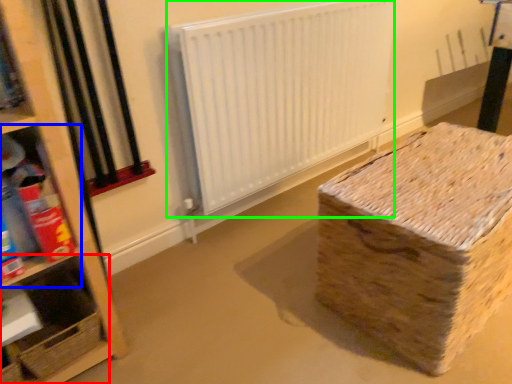
Question: Which object is the farthest from shelf (highlighted by a red box)? Choose among these: shelf (highlighted by a blue box) or radiator (highlighted by a green box).

Choices:
 (A) shelf
 (B) radiator

Answer: (B)